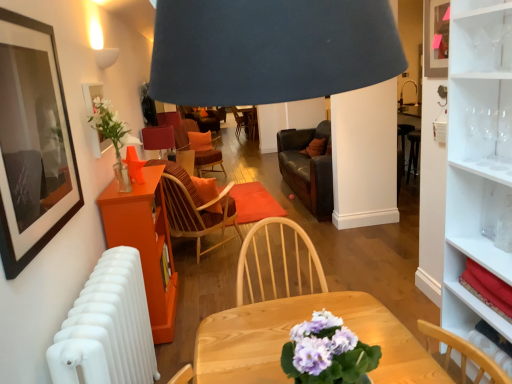
Measure the distance between white matte lampshade at upper center and camera.

white matte lampshade at upper center is 2.97 meters away from camera.

Identify the location of white glossy cabinet at upper right. (481, 264).

In order to face matte black picture frame at upper left, positioned as the 1th picture frame in front-to-back order, should I rotate leftwards or rightwards?

You should rotate left by 27.339 degrees.

Describe the element at coordinates (108, 326) in the screenshot. The height and width of the screenshot is (384, 512). I see `white matte radiator at lower left` at that location.

Describe the element at coordinates (178, 128) in the screenshot. I see `orange fabric chair at center, the 1th chair in the back-to-front sequence` at that location.

At what (x,y) coordinates should I click in order to perform the action: click on white matte lampshade at upper center. Please return your answer as a coordinate pair (x, y). Image resolution: width=512 pixels, height=384 pixels. Looking at the image, I should click on (106, 57).

From the image's perspective, would you say white matte lampshade at upper center is positioned over clear glass vase at upper left?

Correct, white matte lampshade at upper center appears higher than clear glass vase at upper left in the image.

From a real-world perspective, is white matte lampshade at upper center above or below clear glass vase at upper left?

In terms of real-world spatial position, white matte lampshade at upper center is above clear glass vase at upper left.

How different are the orientations of white matte lampshade at upper center and clear glass vase at upper left in degrees?

They differ by 1.71 degrees in their facing directions.

Considering the sizes of white matte lampshade at upper center and clear glass vase at upper left in the image, is white matte lampshade at upper center taller or shorter than clear glass vase at upper left?

Considering their sizes, white matte lampshade at upper center has less height than clear glass vase at upper left.

From the image's perspective, between orange fabric pillow at center and clear glass wine glass at upper right, which is counted as the 3th wine glass, starting from the right, who is located below?

clear glass wine glass at upper right, which is counted as the 3th wine glass, starting from the right.

Is orange fabric pillow at center next to clear glass wine glass at upper right, which is counted as the 3th wine glass, starting from the right, and touching it?

orange fabric pillow at center and clear glass wine glass at upper right, which is counted as the 3th wine glass, starting from the right, are clearly separated.

Based on the photo, who is more distant, orange fabric pillow at center or clear glass wine glass at upper right, marked as the first wine glass in a left-to-right arrangement?

Positioned behind is orange fabric pillow at center.

From a real-world perspective, who is located lower, orange fabric pillow at center or clear glass wine glass at upper right, marked as the first wine glass in a left-to-right arrangement?

orange fabric pillow at center is physically lower.

From the image's perspective, is matte red table lamp at center located above or below matte glass picture frame at upper left, which appears as the second picture frame when viewed from the front?

matte red table lamp at center is situated lower than matte glass picture frame at upper left, which appears as the second picture frame when viewed from the front, in the image.

From the picture: Which is correct: matte red table lamp at center is inside matte glass picture frame at upper left, arranged as the first picture frame when viewed from the back, or outside of it?

matte red table lamp at center cannot be found inside matte glass picture frame at upper left, arranged as the first picture frame when viewed from the back.

Is matte red table lamp at center facing away from matte glass picture frame at upper left, which appears as the second picture frame when viewed from the front?

No, matte glass picture frame at upper left, which appears as the second picture frame when viewed from the front, is not at the back of matte red table lamp at center.

How many degrees apart are the facing directions of matte red table lamp at center and matte glass picture frame at upper left, which appears as the second picture frame when viewed from the front?

The angle between the facing direction of matte red table lamp at center and the facing direction of matte glass picture frame at upper left, which appears as the second picture frame when viewed from the front, is 0.106 degrees.

Which of these two, white glossy cabinet at upper right or orange fabric chair at center, which appears as the 2th chair when viewed from the front, is bigger?

Bigger between the two is orange fabric chair at center, which appears as the 2th chair when viewed from the front.

Considering the positions of point (477, 255) and point (176, 121), is point (477, 255) closer or farther from the camera than point (176, 121)?

Clearly, point (477, 255) is closer to the camera than point (176, 121).

Is white glossy cabinet at upper right behind orange fabric chair at center, which appears as the 2th chair when viewed from the front?

That is False.

From the image's perspective, would you say white glossy cabinet at upper right is positioned over orange fabric chair at center, which appears as the 2th chair when viewed from the front?

Actually, white glossy cabinet at upper right appears below orange fabric chair at center, which appears as the 2th chair when viewed from the front, in the image.

Looking at this image, from a real-world perspective, is matte black picture frame at upper left, positioned as the 1th picture frame in front-to-back order, on top of white matte radiator at lower left?

Yes, from a real-world perspective, matte black picture frame at upper left, positioned as the 1th picture frame in front-to-back order, is above white matte radiator at lower left.

Is point (77, 166) closer to camera compared to point (156, 372)?

Yes.

Considering the sizes of matte black picture frame at upper left, positioned as the 1th picture frame in front-to-back order, and white matte radiator at lower left in the image, is matte black picture frame at upper left, positioned as the 1th picture frame in front-to-back order, wider or thinner than white matte radiator at lower left?

matte black picture frame at upper left, positioned as the 1th picture frame in front-to-back order, is thinner than white matte radiator at lower left.

Measure the distance between matte black picture frame at upper left, acting as the 1th picture frame starting from the right, and white matte radiator at lower left.

matte black picture frame at upper left, acting as the 1th picture frame starting from the right, is 22.49 inches from white matte radiator at lower left.

From a real-world perspective, relative to white matte lampshade at upper center, is clear glass wine glass at upper right, the 2th wine glass in the right-to-left sequence, vertically above or below?

Clearly, from a real-world perspective, clear glass wine glass at upper right, the 2th wine glass in the right-to-left sequence, is below white matte lampshade at upper center.

Which is correct: clear glass wine glass at upper right, the second wine glass positioned from the left, is inside white matte lampshade at upper center, or outside of it?

clear glass wine glass at upper right, the second wine glass positioned from the left, is outside white matte lampshade at upper center.

In terms of height, does clear glass wine glass at upper right, the second wine glass positioned from the left, look taller or shorter compared to white matte lampshade at upper center?

In the image, clear glass wine glass at upper right, the second wine glass positioned from the left, appears to be taller than white matte lampshade at upper center.

Based on the photo, considering the positions of objects clear glass wine glass at upper right, the second wine glass positioned from the left, and white matte lampshade at upper center in the image provided, who is more to the right, clear glass wine glass at upper right, the second wine glass positioned from the left, or white matte lampshade at upper center?

clear glass wine glass at upper right, the second wine glass positioned from the left.

Which point is more forward, (191, 141) or (167, 131)?

The point (167, 131) is more forward.

Can you confirm if orange fabric pillow at center is positioned to the left of matte red table lamp at center?

Incorrect, orange fabric pillow at center is not on the left side of matte red table lamp at center.

Consider the image. What's the angular difference between orange fabric pillow at center and matte red table lamp at center's facing directions?

There is a 69.1-degree angle between the facing directions of orange fabric pillow at center and matte red table lamp at center.

From a real-world perspective, is orange fabric pillow at center physically above matte red table lamp at center?

Incorrect, from a real-world perspective, orange fabric pillow at center is lower than matte red table lamp at center.

The width and height of the screenshot is (512, 384). I want to click on houseplant that is below the white matte lampshade at upper center (from the image's perspective), so click(x=112, y=138).

Starting from the orange fabric pillow at center, which wine glass is the 1st one to the right? Please provide its 2D coordinates.

[(472, 133)]

Looking at the image, which one is located further to clear glass wine glass at upper right, the second wine glass positioned from the left, orange fabric pillow at center or white glossy cabinet at upper right?

orange fabric pillow at center lies further to clear glass wine glass at upper right, the second wine glass positioned from the left, than the other object.

Estimate the real-world distances between objects in this image. Which object is further from clear glass wine glass at upper right, the 2th wine glass in the right-to-left sequence, orange fabric pillow at center or white matte lampshade at upper center?

Among the two, orange fabric pillow at center is located further to clear glass wine glass at upper right, the 2th wine glass in the right-to-left sequence.

Estimate the real-world distances between objects in this image. Which object is further from matte black picture frame at upper left, acting as the 1th picture frame starting from the right, matte red table lamp at center or orange fabric chair at center, which appears as the 2th chair when viewed from the front?

Among the two, orange fabric chair at center, which appears as the 2th chair when viewed from the front, is located further to matte black picture frame at upper left, acting as the 1th picture frame starting from the right.

Estimate the real-world distances between objects in this image. Which object is further from clear glass wine glass at upper right, acting as the first wine glass starting from the right, matte black picture frame at upper left, acting as the 1th picture frame starting from the right, or clear glass wine glass at upper right, the second wine glass positioned from the left?

Among the two, matte black picture frame at upper left, acting as the 1th picture frame starting from the right, is located further to clear glass wine glass at upper right, acting as the first wine glass starting from the right.

From the image, which object appears to be farther from clear glass wine glass at upper right, arranged as the third wine glass when viewed from the left, matte red table lamp at center or white matte radiator at lower left?

matte red table lamp at center is positioned further to the anchor clear glass wine glass at upper right, arranged as the third wine glass when viewed from the left.

Based on their spatial positions, is clear glass wine glass at upper right, the 2th wine glass in the right-to-left sequence, or orange fabric pillow at center closer to orange wood table at left?

The object closer to orange wood table at left is clear glass wine glass at upper right, the 2th wine glass in the right-to-left sequence.

Based on the photo, considering their positions, is clear glass vase at upper left positioned further to matte glass picture frame at upper left, which is the first picture frame from left to right, than orange fabric chair at center, the 1th chair in the back-to-front sequence?

orange fabric chair at center, the 1th chair in the back-to-front sequence, lies further to matte glass picture frame at upper left, which is the first picture frame from left to right, than the other object.

Looking at the image, which one is located closer to orange wood table at left, clear glass wine glass at upper right, which is counted as the 3th wine glass, starting from the right, or matte black picture frame at upper left, acting as the 1th picture frame starting from the right?

matte black picture frame at upper left, acting as the 1th picture frame starting from the right.

Locate an element on the screen. The width and height of the screenshot is (512, 384). table lamp between white matte lampshade at upper center and orange fabric pillow at center along the z-axis is located at coordinates (158, 138).

I want to click on table between clear glass wine glass at upper right, the second wine glass positioned from the left, and orange fabric pillow at center, along the z-axis, so click(x=145, y=243).

Locate an element on the screen. table lamp between matte black picture frame at upper left, arranged as the 2th picture frame when viewed from the back, and orange fabric pillow at center from front to back is located at coordinates (158, 138).

Image resolution: width=512 pixels, height=384 pixels. I want to click on lamp located between clear glass wine glass at upper right, marked as the first wine glass in a left-to-right arrangement, and orange fabric pillow at center in the depth direction, so click(106, 57).